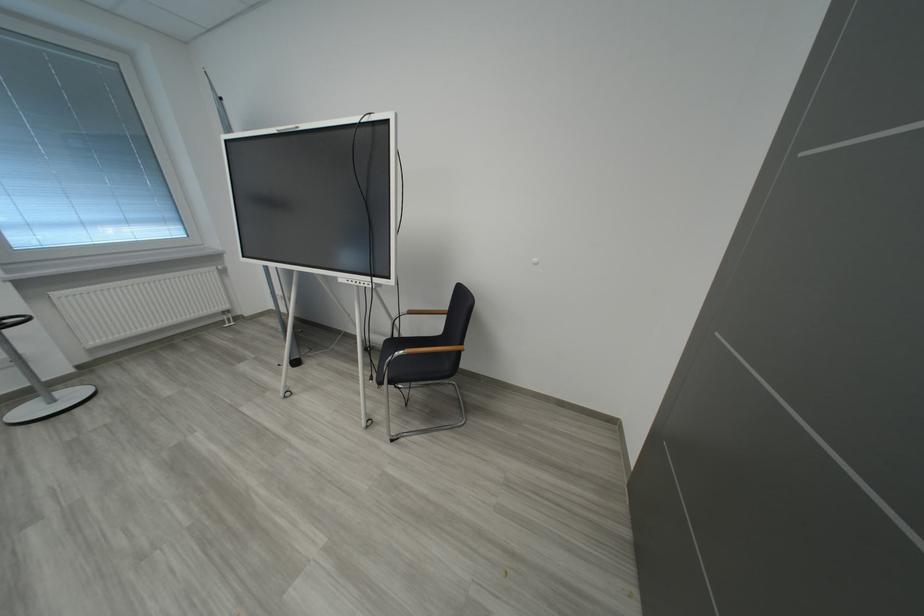
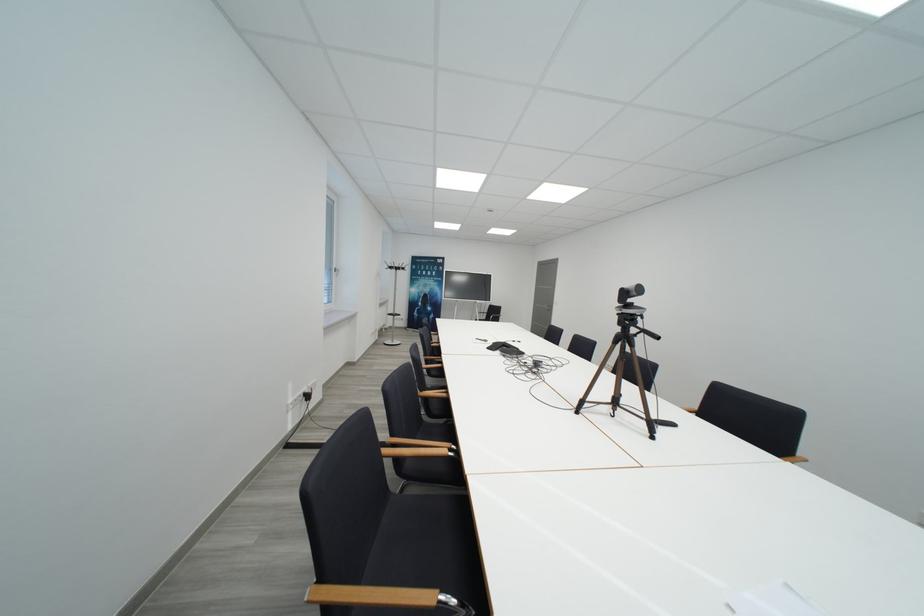
Question: I am providing you with two images of the same scene from different viewpoints. After the viewpoint changes to image2, which objects are now occluded?

Choices:
 (A) black webcam
 (B) black chair sitting surface
 (C) white window handle
 (D) white paper roll

Answer: (B)